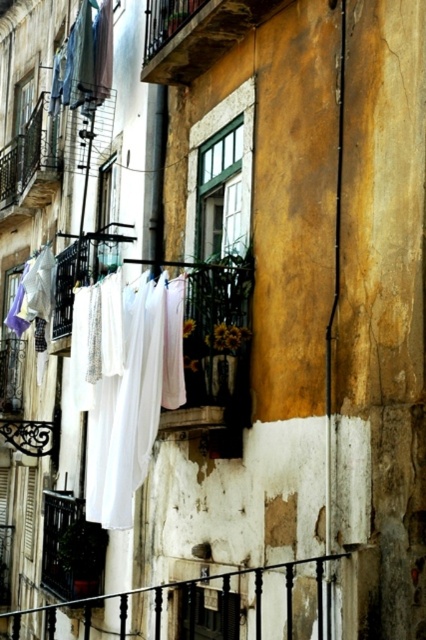
Does black metal railing at lower center come behind white cotton shirt at upper left?

No, it is in front of white cotton shirt at upper left.

Can you confirm if black metal railing at lower center is positioned above white cotton shirt at upper left?

No.

Locate an element on the screen. The height and width of the screenshot is (640, 426). black metal railing at lower center is located at coordinates (199, 608).

Identify the location of black metal railing at lower center. This screenshot has width=426, height=640. (199, 608).

Can you confirm if white fabric at center is bigger than white cotton shirt at upper left?

Indeed, white fabric at center has a larger size compared to white cotton shirt at upper left.

Can you confirm if white fabric at center is taller than white cotton shirt at upper left?

Yes.

The width and height of the screenshot is (426, 640). Describe the element at coordinates (124, 384) in the screenshot. I see `white fabric at center` at that location.

Identify the location of white fabric at center. (124, 384).

Who is lower down, white fabric at center or black metal railing at lower center?

black metal railing at lower center is below.

Is the position of white fabric at center more distant than that of black metal railing at lower center?

Yes, white fabric at center is further from the viewer.

Between point (173, 324) and point (322, 605), which one is positioned in front?

Point (322, 605) is in front.

Locate an element on the screen. white fabric at center is located at coordinates (124, 384).